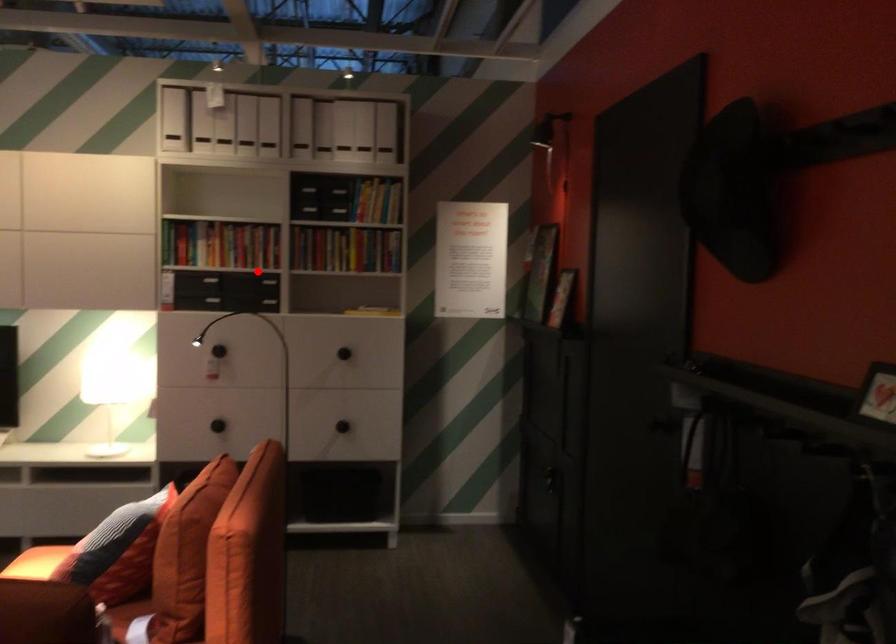
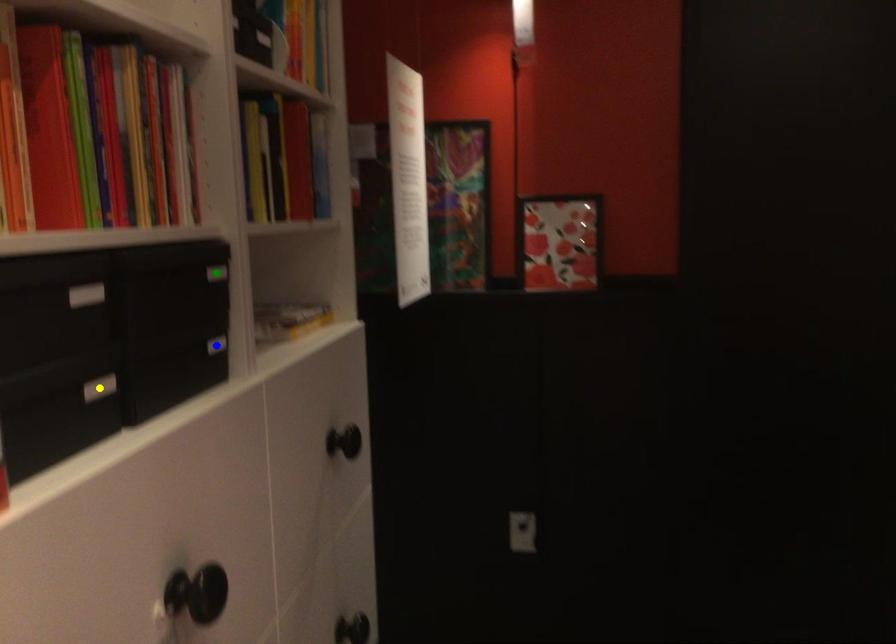
Question: I am providing you with two images of the same scene from different viewpoints. A red point is marked on the first image. You are given multiple points on the second image. Can you choose the point in image 2 that corresponds to the point in image 1?

Choices:
 (A) green point
 (B) yellow point
 (C) blue point

Answer: (A)